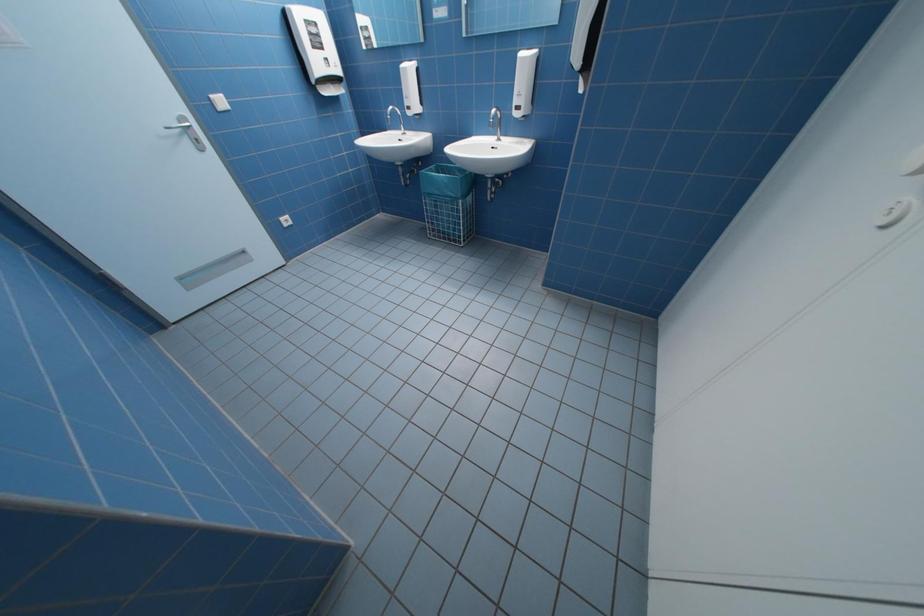
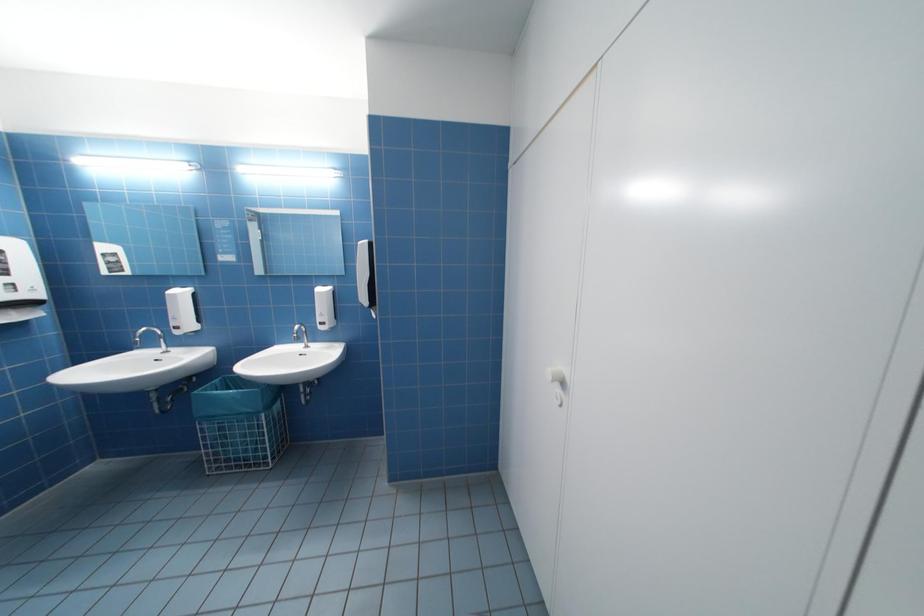
The images are taken continuously from a first-person perspective. In which direction is your viewpoint rotating?

The camera rotated toward right-up.